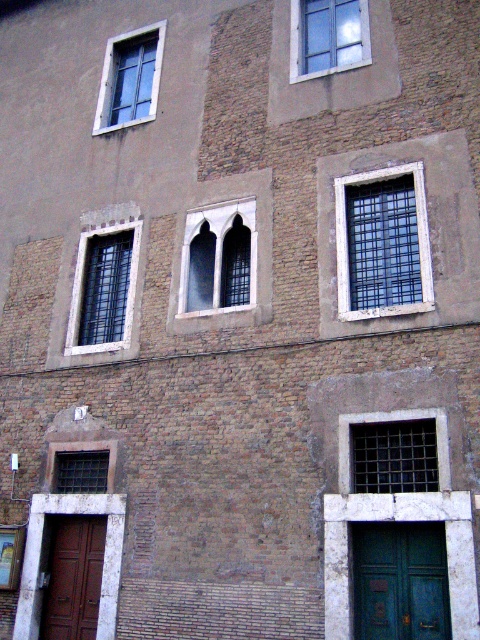
Question: Is clear glass window at upper center positioned behind matte black window at lower left?

Choices:
 (A) no
 (B) yes

Answer: (B)

Question: Which object appears farthest from the camera in this image?

Choices:
 (A) dark gray metal grate at center
 (B) matte black window at left
 (C) blue glass window at center
 (D) matte glass window at upper left

Answer: (D)

Question: Which of these objects is positioned closest to the teal matte door at lower right?

Choices:
 (A) blue glass window at center
 (B) gray stone window at center
 (C) dark gray metal grate at center

Answer: (C)

Question: Which point is closer to the camera taking this photo?

Choices:
 (A) (349, 236)
 (B) (147, 33)

Answer: (A)

Question: Can you confirm if teal matte door at lower right is positioned to the right of clear glass window at upper center?

Choices:
 (A) no
 (B) yes

Answer: (B)

Question: Can you confirm if blue glass window at center is bigger than brown wooden door at lower left?

Choices:
 (A) yes
 (B) no

Answer: (A)